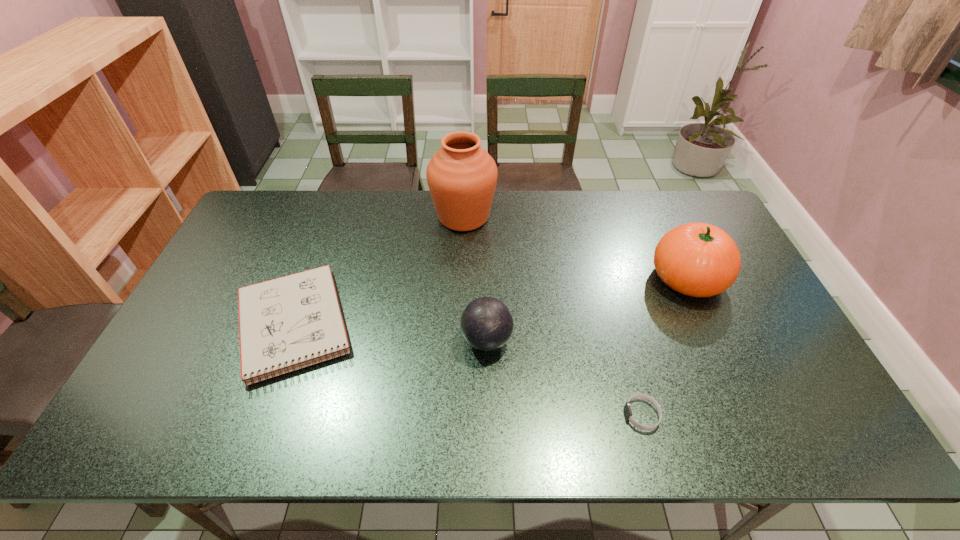
In order to click on free space that is in between the rightmost object and the bowling ball in this screenshot , I will do `click(588, 309)`.

At what (x,y) coordinates should I click in order to perform the action: click on free space between the rightmost object and the shortest object. Please return your answer as a coordinate pair (x, y). This screenshot has width=960, height=540. Looking at the image, I should click on (664, 347).

Where is `empty location between the fourth object from left to right and the third tallest object`? The height and width of the screenshot is (540, 960). empty location between the fourth object from left to right and the third tallest object is located at coordinates (564, 377).

I want to click on empty space that is in between the rightmost object and the tallest object, so click(575, 247).

Locate which object ranks in proximity to the third tallest object. Please provide its 2D coordinates. Your answer should be formatted as a tuple, i.e. [(x, y)], where the tuple contains the x and y coordinates of a point satisfying the conditions above.

[(627, 409)]

The height and width of the screenshot is (540, 960). In order to click on object that is the fourth closest to the tallest object in this screenshot , I will do `click(627, 409)`.